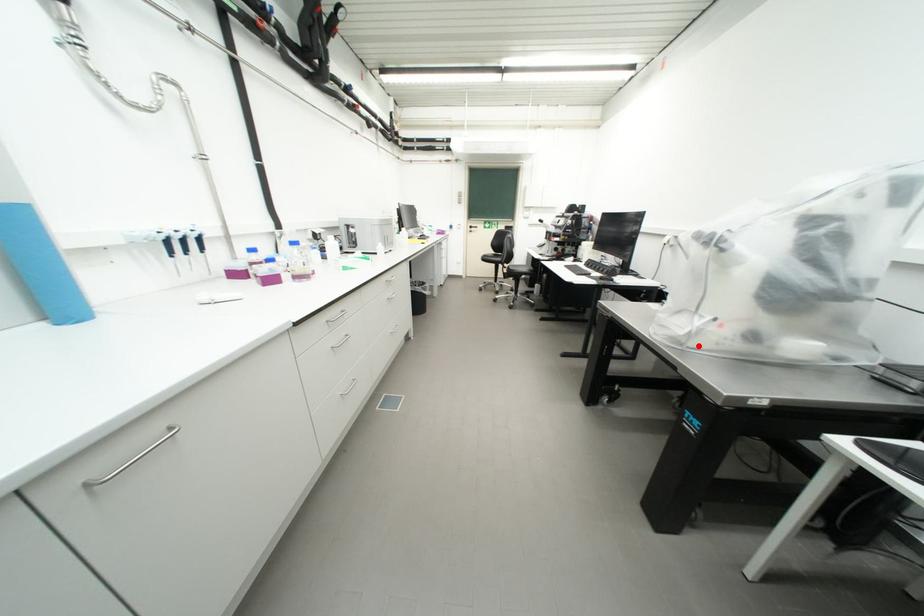
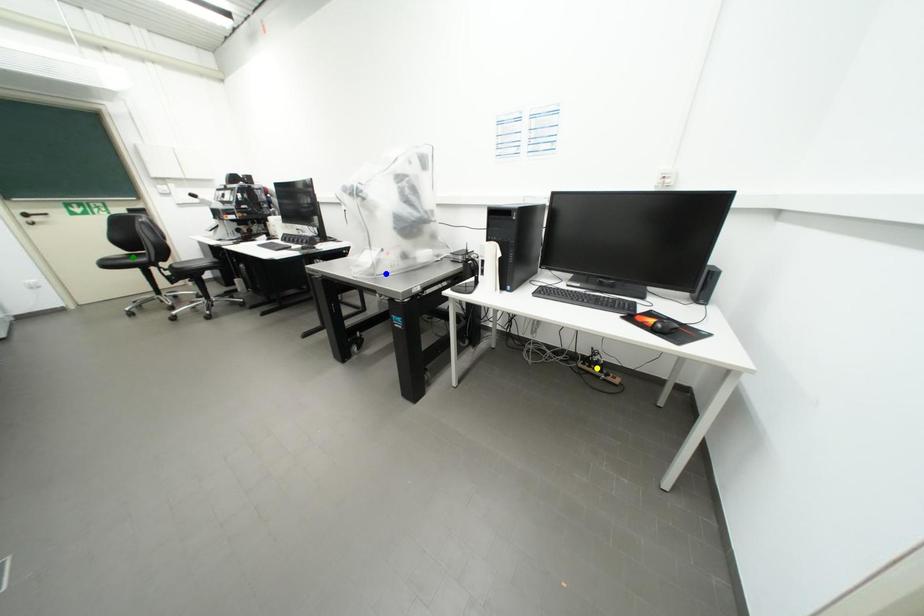
Question: I am providing you with two images of the same scene from different viewpoints. A red point is marked on the first image. You are given multiple points on the second image. Can you choose the point in image 2 that corresponds to the point in image 1?

Choices:
 (A) blue point
 (B) green point
 (C) yellow point

Answer: (A)